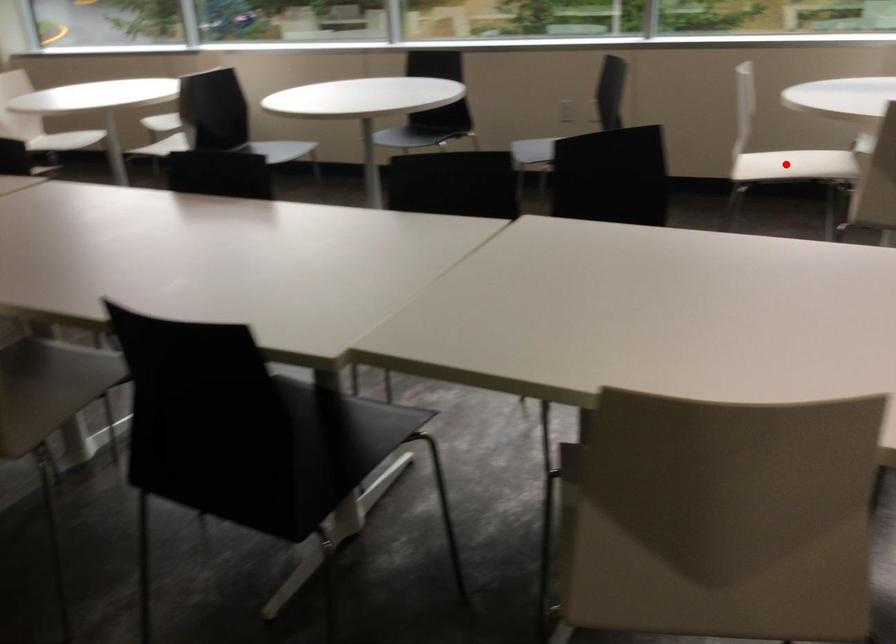
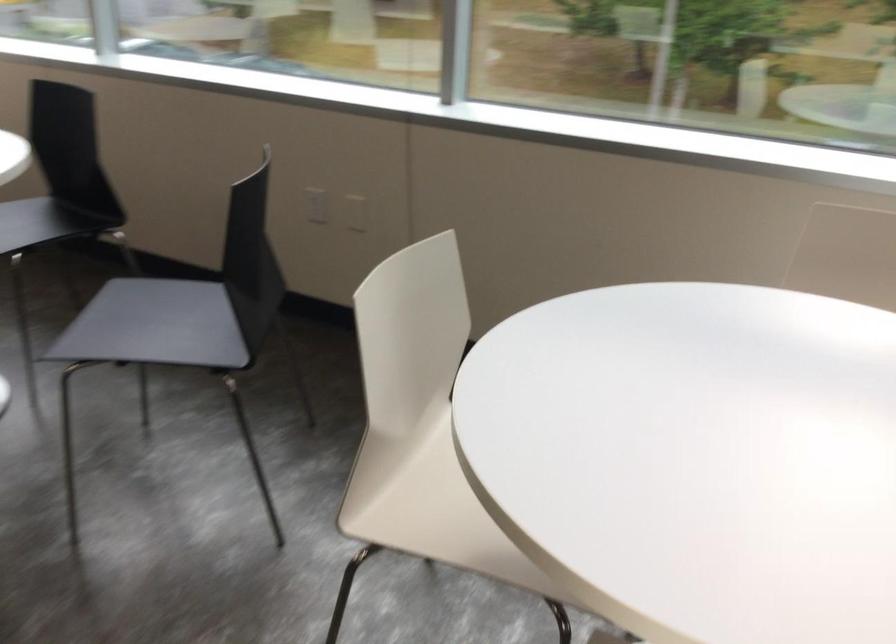
The point at the highlighted location is marked in the first image. Where is the corresponding point in the second image?

(431, 509)